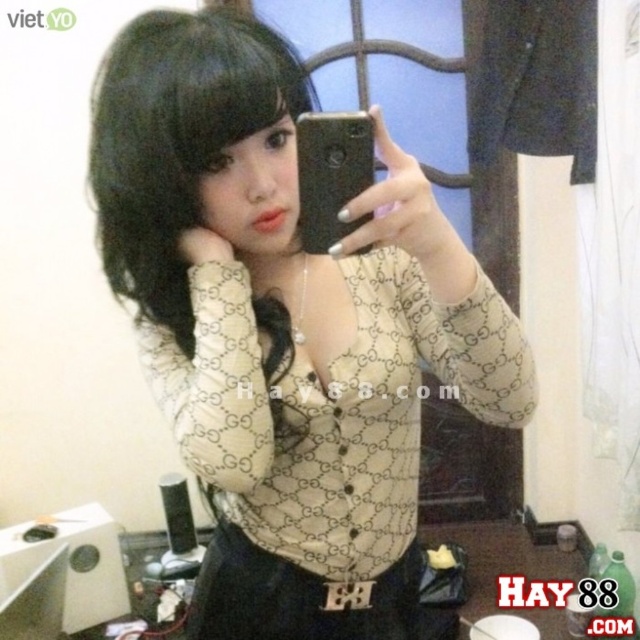
Does black silky hair at upper left lie behind black matte smartphone at center?

Yes, it is behind black matte smartphone at center.

Consider the image. Does black silky hair at upper left come in front of black matte smartphone at center?

No, black silky hair at upper left is behind black matte smartphone at center.

The width and height of the screenshot is (640, 640). In order to click on black silky hair at upper left in this screenshot , I will do `click(177, 140)`.

I want to click on black silky hair at upper left, so click(x=177, y=140).

Does beige printed shirt at center appear on the left side of black silky hair at upper left?

Incorrect, beige printed shirt at center is not on the left side of black silky hair at upper left.

Who is higher up, beige printed shirt at center or black silky hair at upper left?

Positioned higher is black silky hair at upper left.

Is point (428, 266) less distant than point (161, 204)?

Yes, point (428, 266) is closer to viewer.

Find the location of a particular element. This screenshot has height=640, width=640. beige printed shirt at center is located at coordinates (285, 328).

Which of these two, beige printed shirt at center or black matte smartphone at center, stands shorter?

black matte smartphone at center

Based on the photo, between beige printed shirt at center and black matte smartphone at center, which one is positioned lower?

beige printed shirt at center is lower down.

Is point (512, 372) more distant than point (371, 156)?

Yes, it is.

The height and width of the screenshot is (640, 640). Identify the location of beige printed shirt at center. (285, 328).